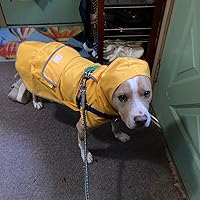
Image resolution: width=200 pixels, height=200 pixels. Identify the location of green door. click(165, 98).